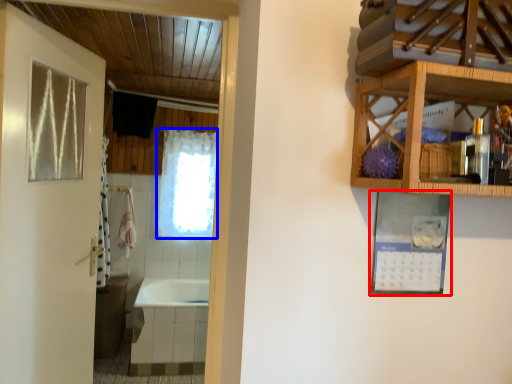
Question: Which point is closer to the camera, picture frame (highlighted by a red box) or curtain (highlighted by a blue box)?

Choices:
 (A) picture frame
 (B) curtain

Answer: (A)